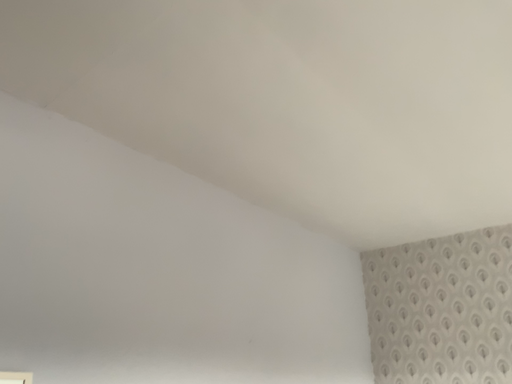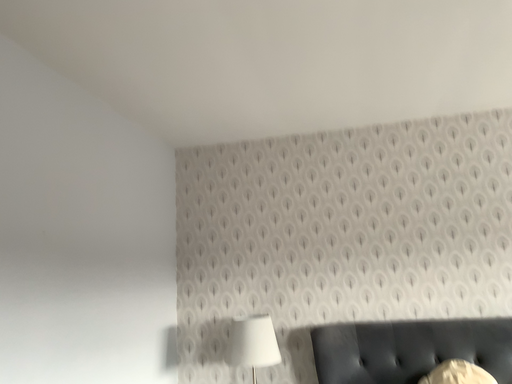
Question: Which way did the camera rotate in the video?

Choices:
 (A) rotated upward
 (B) rotated downward

Answer: (B)